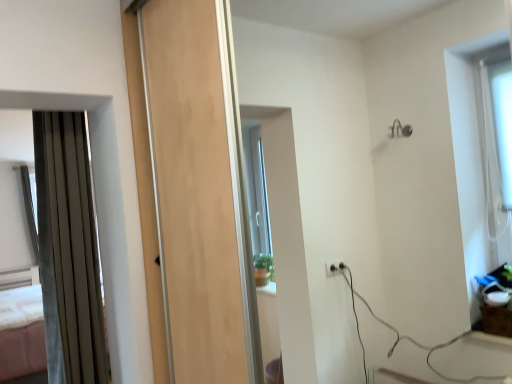
Image resolution: width=512 pixels, height=384 pixels. Find the location of `dark gray fabric curtain at left`. dark gray fabric curtain at left is located at coordinates (68, 251).

What do you see at coordinates (68, 251) in the screenshot?
I see `dark gray fabric curtain at left` at bounding box center [68, 251].

This screenshot has width=512, height=384. What are the coordinates of `dark gray fabric curtain at left` in the screenshot? It's located at (68, 251).